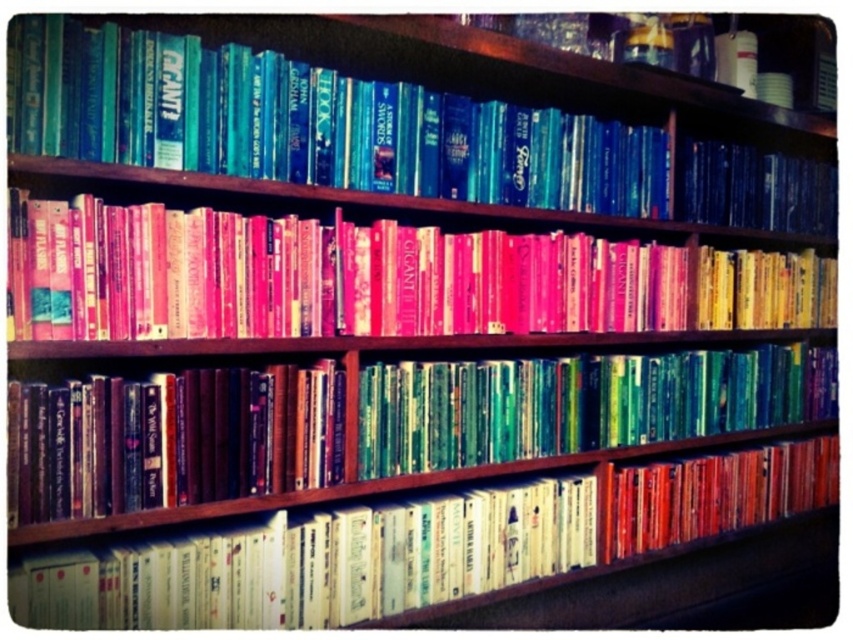
You are organizing a bookshelf and want to place a new book between the pink matte book at center and the shiny blue book at upper right. Which book should you place the new book next to if you want it to have more space on either side?

You should place the new book next to the pink matte book at center because its width is larger than the shiny blue book at upper right, providing more space on either side.

You are organizing books on a shelf and need to stack them vertically. The pink matte book at center and the shiny green book at center are both candidates. Given their height difference, which book should you choose to ensure stability?

The pink matte book at center is much taller than the shiny green book at center, so choosing the pink matte book at center would provide a more stable base due to its greater height and weight distribution.